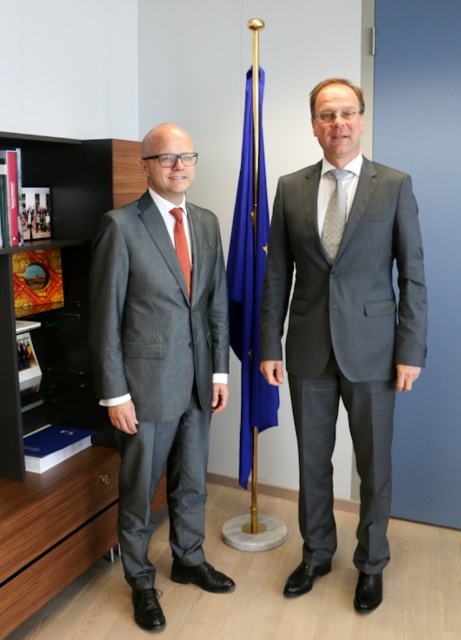
Question: Is matte gray suit at left positioned at the back of orange silk tie at left?

Choices:
 (A) yes
 (B) no

Answer: (B)

Question: Does wooden bookshelf at left appear over blue fabric flag at center?

Choices:
 (A) no
 (B) yes

Answer: (A)

Question: Based on their relative distances, which object is nearer to the wooden bookshelf at left?

Choices:
 (A) blue fabric flag at center
 (B) matte gray suit at right
 (C) orange silk tie at left
 (D) gray textured tie at center

Answer: (A)

Question: Where is matte gray suit at right located in relation to blue fabric flag at center in the image?

Choices:
 (A) below
 (B) above

Answer: (A)

Question: Among these points, which one is farthest from the camera?

Choices:
 (A) pyautogui.click(x=252, y=240)
 (B) pyautogui.click(x=344, y=305)

Answer: (A)

Question: Which of the following is the closest to the observer?

Choices:
 (A) (179, 260)
 (B) (246, 154)
 (C) (0, 365)
 (D) (206, 369)

Answer: (A)